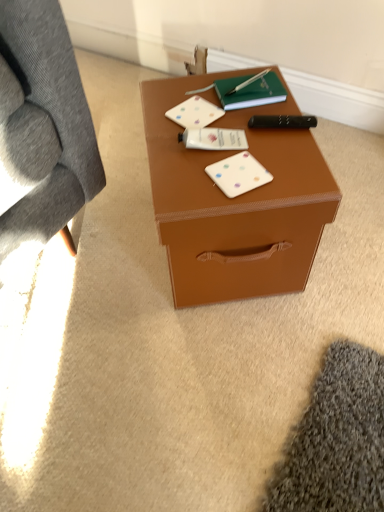
Where is `free space between black plastic remote control at right and white matte card game at center, the first card game in the back-to-front sequence`? free space between black plastic remote control at right and white matte card game at center, the first card game in the back-to-front sequence is located at coordinates (248, 119).